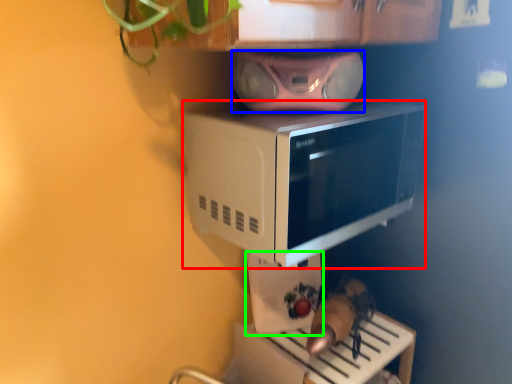
Question: Based on their relative distances, which object is farther from microwave oven (highlighted by a red box)? Choose from stereo (highlighted by a blue box) and appliance (highlighted by a green box).

Choices:
 (A) stereo
 (B) appliance

Answer: (A)